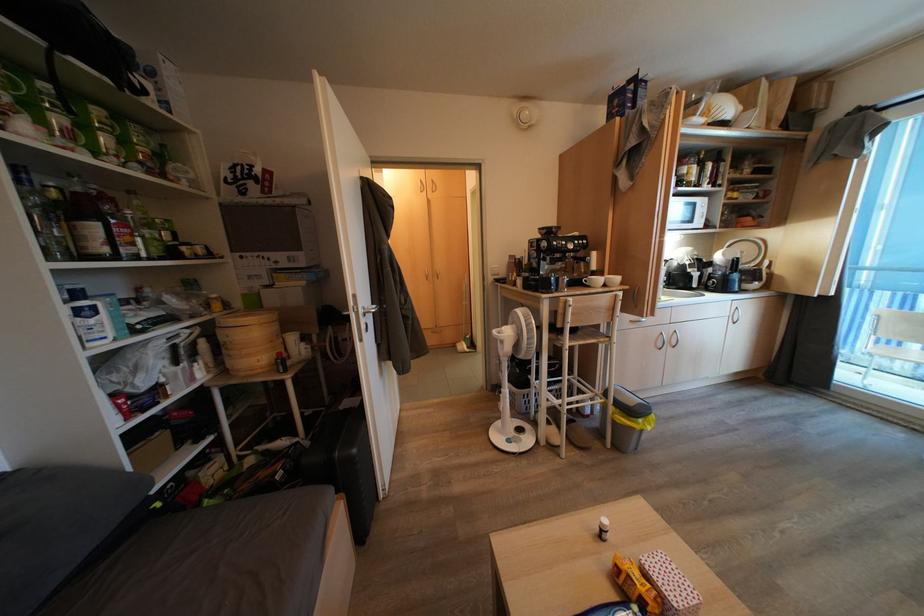
What do you see at coordinates (358, 275) in the screenshot?
I see `a silver door handle` at bounding box center [358, 275].